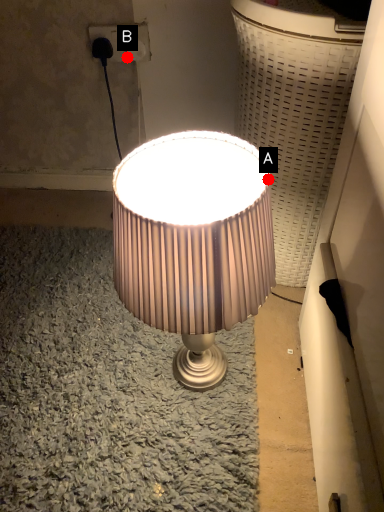
Question: Two points are circled on the image, labeled by A and B beside each circle. Among these points, which one is farthest from the camera?

Choices:
 (A) A is further
 (B) B is further

Answer: (B)